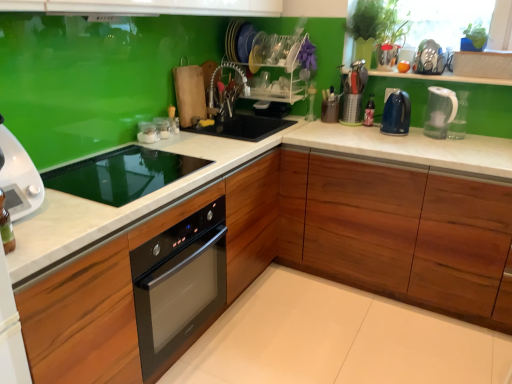
Question: Is there a large distance between clear glass jars at center, which is counted as the 3th appliance, starting from the left, and white glossy microwave at left?

Choices:
 (A) yes
 (B) no

Answer: (B)

Question: Is white glossy microwave at left completely or partially inside clear glass jars at center, the fourth appliance when ordered from right to left?

Choices:
 (A) yes
 (B) no

Answer: (B)

Question: From the image's perspective, is clear glass jars at center, the fourth appliance when ordered from right to left, over white glossy microwave at left?

Choices:
 (A) yes
 (B) no

Answer: (A)

Question: Is clear glass jars at center, the fourth appliance when ordered from right to left, outside of white glossy microwave at left?

Choices:
 (A) no
 (B) yes

Answer: (B)

Question: Does clear glass jars at center, the fourth appliance when ordered from right to left, lie behind white glossy microwave at left?

Choices:
 (A) yes
 (B) no

Answer: (A)

Question: From the image's perspective, is wooden cabinet at center, which appears as the 1th cabinetry when viewed from the left, located above or below clear plastic dish rack at center, which ranks as the 1th shelf in top-to-bottom order?

Choices:
 (A) above
 (B) below

Answer: (B)

Question: Is wooden cabinet at center, which is counted as the second cabinetry, starting from the right, in front of or behind clear plastic dish rack at center, which ranks as the 1th shelf in top-to-bottom order, in the image?

Choices:
 (A) front
 (B) behind

Answer: (A)

Question: Would you say wooden cabinet at center, which appears as the 1th cabinetry when viewed from the left, is to the left or to the right of clear plastic dish rack at center, the second shelf in the bottom-to-top sequence, in the picture?

Choices:
 (A) right
 (B) left

Answer: (B)

Question: Considering the positions of point (224, 306) and point (303, 56), is point (224, 306) closer or farther from the camera than point (303, 56)?

Choices:
 (A) closer
 (B) farther

Answer: (A)

Question: In terms of width, does metallic silver utensil holder at upper right, which ranks as the 2th appliance in right-to-left order, look wider or thinner when compared to clear glass jar at upper center, acting as the sixth appliance starting from the right?

Choices:
 (A) wide
 (B) thin

Answer: (A)

Question: From a real-world perspective, is metallic silver utensil holder at upper right, marked as the 5th appliance in a left-to-right arrangement, positioned above or below clear glass jar at upper center, acting as the sixth appliance starting from the right?

Choices:
 (A) below
 (B) above

Answer: (B)

Question: From the image's perspective, relative to clear glass jar at upper center, acting as the sixth appliance starting from the right, is metallic silver utensil holder at upper right, marked as the 5th appliance in a left-to-right arrangement, above or below?

Choices:
 (A) below
 (B) above

Answer: (B)

Question: Is metallic silver utensil holder at upper right, marked as the 5th appliance in a left-to-right arrangement, in front of or behind clear glass jar at upper center, the 1th appliance from the left, in the image?

Choices:
 (A) front
 (B) behind

Answer: (B)

Question: Considering the positions of point (304, 76) and point (369, 96), is point (304, 76) closer or farther from the camera than point (369, 96)?

Choices:
 (A) closer
 (B) farther

Answer: (B)

Question: Looking at the image, does clear plastic dish rack at center, which ranks as the 1th shelf in top-to-bottom order, seem bigger or smaller compared to clear plastic bottle at center, which is the 1th bottle from front to back?

Choices:
 (A) big
 (B) small

Answer: (A)